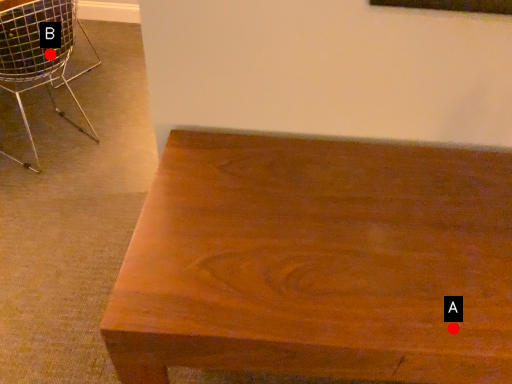
Question: Two points are circled on the image, labeled by A and B beside each circle. Which point is closer to the camera taking this photo?

Choices:
 (A) A is closer
 (B) B is closer

Answer: (A)